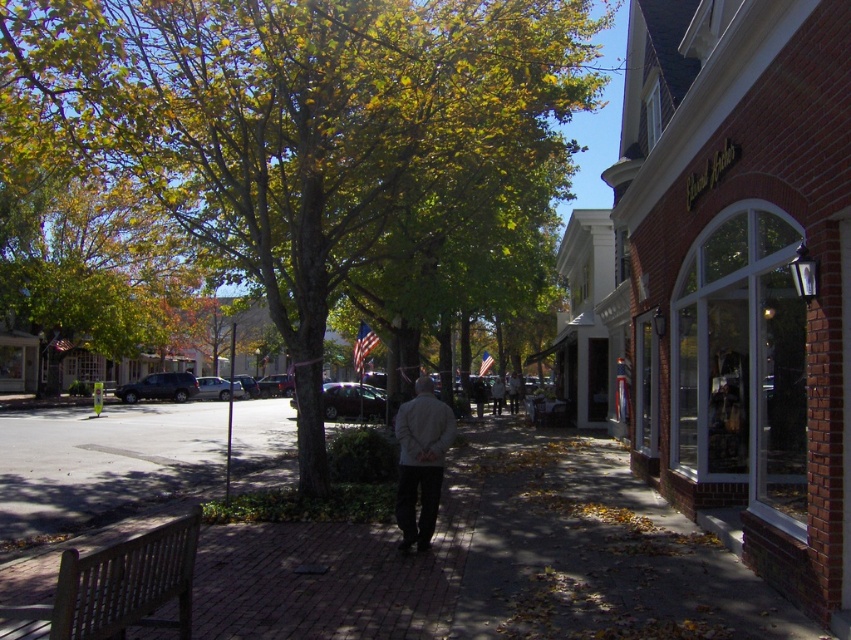
You are standing at the intersection looking at the green leafy tree at center. If you walk straight ahead, will you eventually reach the street with parked cars?

Yes, because the green leafy tree at center is located at point (297, 157), which is along the street where the parked cars are visible along the curb.

From the picture: You are a delivery person with a cart that is 1 meter wide. You need to navigate through the brick pavement at center and the wooden bench at lower left. Which path can your cart safely pass through?

The brick pavement at center has a width larger than the wooden bench at lower left. Since your cart is 1 meter wide, you should choose the brick pavement at center as it is wider and can accommodate your cart safely.

You are a city planner assessing the urban space. Considering the green leafy tree at center and the brick pavement at center, which one is taller?

The green leafy tree at center is taller than the brick pavement at center.